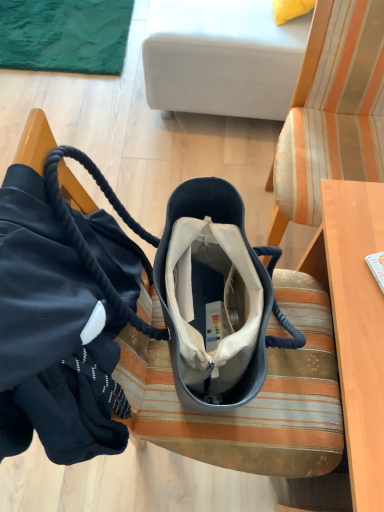
Question: Is the depth of striped fabric chair at center less than that of velvet bag at center?

Choices:
 (A) no
 (B) yes

Answer: (A)

Question: Is the position of striped fabric chair at center more distant than that of velvet bag at center?

Choices:
 (A) yes
 (B) no

Answer: (A)

Question: From the image's perspective, is striped fabric chair at center beneath velvet bag at center?

Choices:
 (A) no
 (B) yes

Answer: (A)

Question: Does striped fabric chair at center have a greater height compared to velvet bag at center?

Choices:
 (A) yes
 (B) no

Answer: (A)

Question: Is striped fabric chair at center thinner than velvet bag at center?

Choices:
 (A) no
 (B) yes

Answer: (A)

Question: Considering the positions of satin black handbag at lower left and striped fabric chair at center in the image, is satin black handbag at lower left wider or thinner than striped fabric chair at center?

Choices:
 (A) wide
 (B) thin

Answer: (B)

Question: Considering the positions of satin black handbag at lower left and striped fabric chair at center in the image, is satin black handbag at lower left bigger or smaller than striped fabric chair at center?

Choices:
 (A) small
 (B) big

Answer: (A)

Question: Considering their positions, is satin black handbag at lower left located in front of or behind striped fabric chair at center?

Choices:
 (A) front
 (B) behind

Answer: (A)

Question: From the image's perspective, relative to striped fabric chair at center, is satin black handbag at lower left above or below?

Choices:
 (A) above
 (B) below

Answer: (B)

Question: Is striped fabric chair at center spatially inside satin black handbag at lower left, or outside of it?

Choices:
 (A) outside
 (B) inside

Answer: (A)

Question: Considering the positions of point (339, 120) and point (48, 437), is point (339, 120) closer or farther from the camera than point (48, 437)?

Choices:
 (A) closer
 (B) farther

Answer: (B)

Question: From the image's perspective, is striped fabric chair at center positioned above or below satin black handbag at lower left?

Choices:
 (A) below
 (B) above

Answer: (B)

Question: Considering the positions of striped fabric chair at center and satin black handbag at lower left in the image, is striped fabric chair at center taller or shorter than satin black handbag at lower left?

Choices:
 (A) short
 (B) tall

Answer: (B)

Question: From a real-world perspective, is velvet bag at center physically located above or below satin black handbag at lower left?

Choices:
 (A) below
 (B) above

Answer: (A)

Question: Is velvet bag at center bigger or smaller than satin black handbag at lower left?

Choices:
 (A) big
 (B) small

Answer: (A)